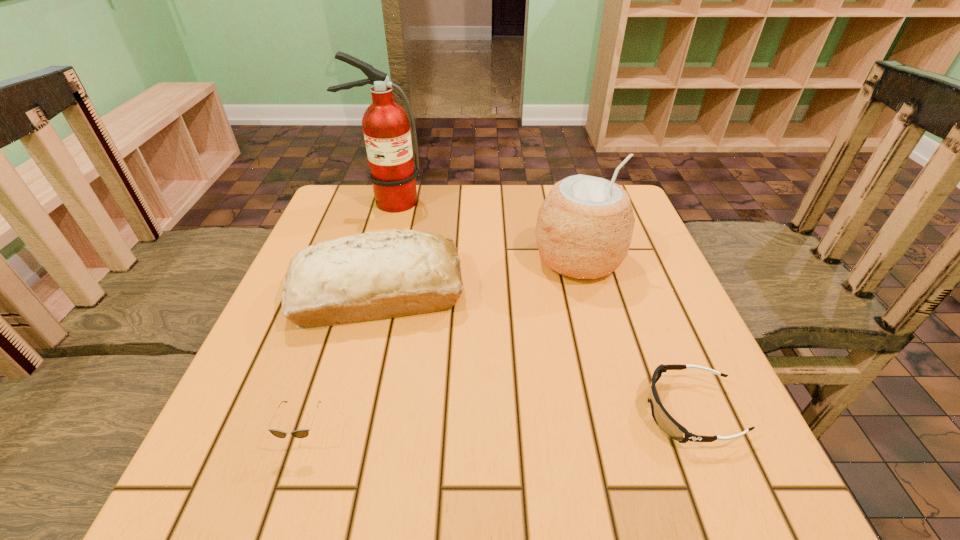
Where is `fire extinguisher`? Image resolution: width=960 pixels, height=540 pixels. fire extinguisher is located at coordinates (386, 126).

I want to click on the farthest object, so click(x=386, y=126).

The height and width of the screenshot is (540, 960). Find the location of `the fourth shortest object`. the fourth shortest object is located at coordinates (584, 228).

Locate an element on the screen. the third shortest object is located at coordinates (375, 275).

The image size is (960, 540). In order to click on sunglasses in this screenshot , I will do `click(302, 433)`.

This screenshot has width=960, height=540. What are the coordinates of `the shortest object` in the screenshot? It's located at (663, 419).

Where is `vacant space located 0.270m on the nozzle and handle of the tallest object`? vacant space located 0.270m on the nozzle and handle of the tallest object is located at coordinates (363, 283).

You are a GUI agent. You are given a task and a screenshot of the screen. Output one action in this format:
    pyautogui.click(x=<x>, y=<y>)
    Task: Click on the blank space located on the front of the second tallest object
    The width and height of the screenshot is (960, 540).
    Given the screenshot: What is the action you would take?
    pyautogui.click(x=593, y=316)

The height and width of the screenshot is (540, 960). What are the coordinates of `blank space located 0.310m on the front of the third tallest object` in the screenshot? It's located at (324, 505).

In order to click on vacant space situated 0.070m in front of the lenses of the second shortest object in this screenshot , I will do `click(281, 503)`.